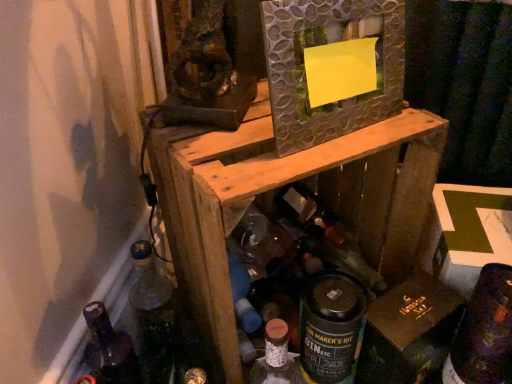
Where is `vacant space situated above wooden crate at center (from a real-world perspective)`? Image resolution: width=512 pixels, height=384 pixels. vacant space situated above wooden crate at center (from a real-world perspective) is located at coordinates (292, 139).